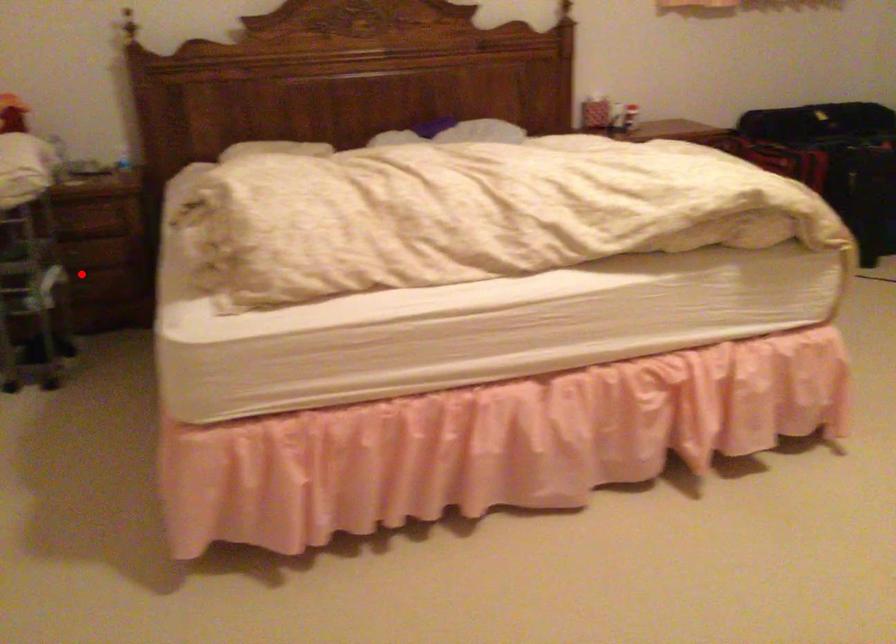
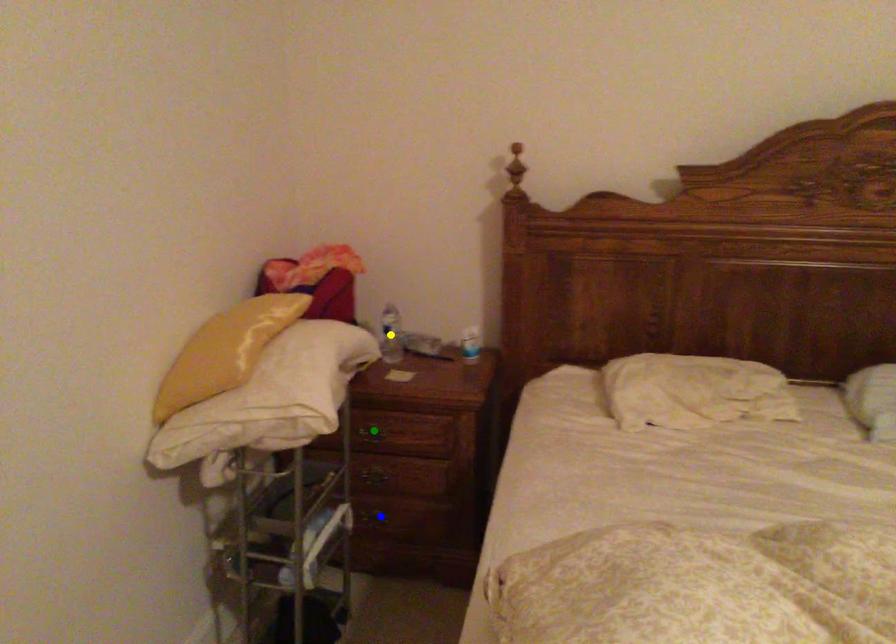
Question: I am providing you with two images of the same scene from different viewpoints. A red point is marked on the first image. You are given multiple points on the second image. Which spot in image 2 lines up with the point in image 1?

Choices:
 (A) blue point
 (B) green point
 (C) yellow point

Answer: (A)